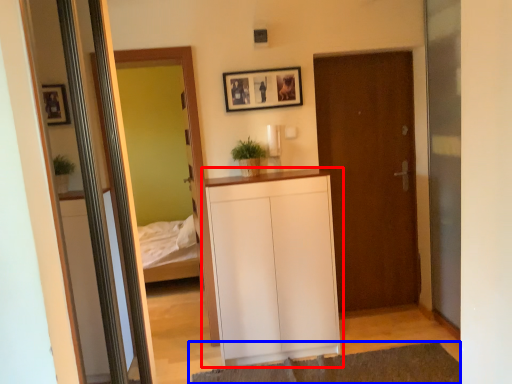
Question: Which point is closer to the camera, cabinetry (highlighted by a red box) or plain (highlighted by a blue box)?

Choices:
 (A) cabinetry
 (B) plain

Answer: (B)